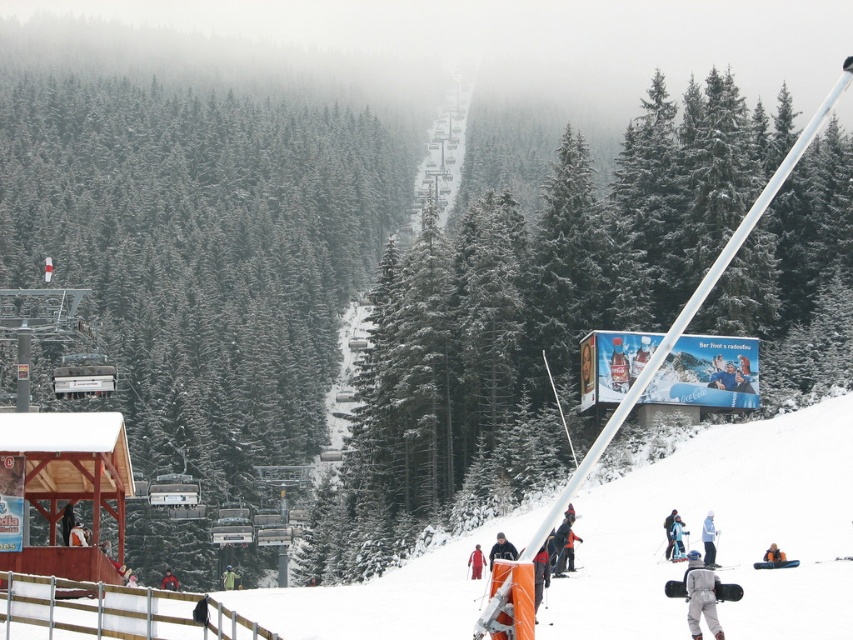
In the scene shown: Is blue matte ski at lower right thinner than blue fabric snowboarder at center?

No, blue matte ski at lower right is not thinner than blue fabric snowboarder at center.

Between blue matte ski at lower right and blue fabric snowboarder at center, which one has more height?

blue fabric snowboarder at center is taller.

Is point (759, 564) positioned after point (776, 548)?

Yes, it is.

Where is `blue matte ski at lower right`? blue matte ski at lower right is located at coordinates (775, 563).

Based on the photo, is green matte tree at center smaller than blue matte ski at lower right?

Actually, green matte tree at center might be larger than blue matte ski at lower right.

Is point (453, 339) positioned in front of point (766, 566)?

No, (453, 339) is further to viewer.

Find the location of a particular element. The width and height of the screenshot is (853, 640). green matte tree at center is located at coordinates (514, 323).

Is white matte snowboarder at center shorter than dark gray jacket at lower center?

Indeed, white matte snowboarder at center has a lesser height compared to dark gray jacket at lower center.

The height and width of the screenshot is (640, 853). Describe the element at coordinates (708, 540) in the screenshot. I see `white matte snowboarder at center` at that location.

This screenshot has width=853, height=640. Describe the element at coordinates (708, 540) in the screenshot. I see `white matte snowboarder at center` at that location.

Where is `white matte snowboarder at center`? The width and height of the screenshot is (853, 640). white matte snowboarder at center is located at coordinates (708, 540).